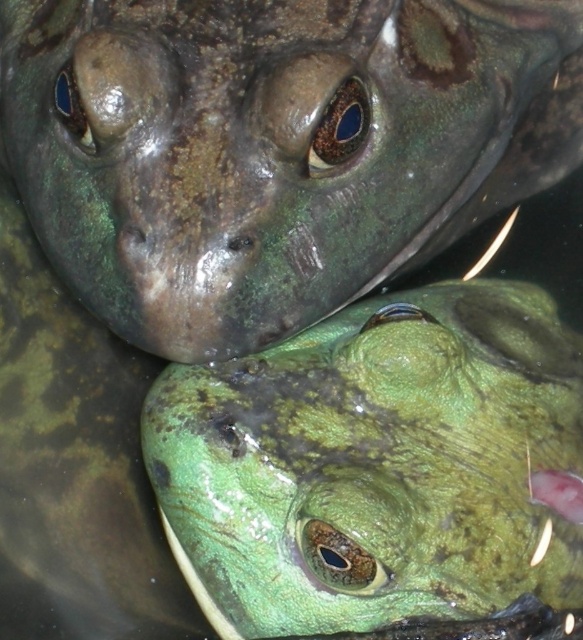
In the scene shown: You are holding a ruler that is 80 centimeters long. You want to measure the distance from your current position to the point marked as point (538, 40). Will your ruler be long enough to reach that point?

The distance between you and point (538, 40) is 86.22 centimeters. Since your ruler is only 80 centimeters long, it is not long enough to reach the point.